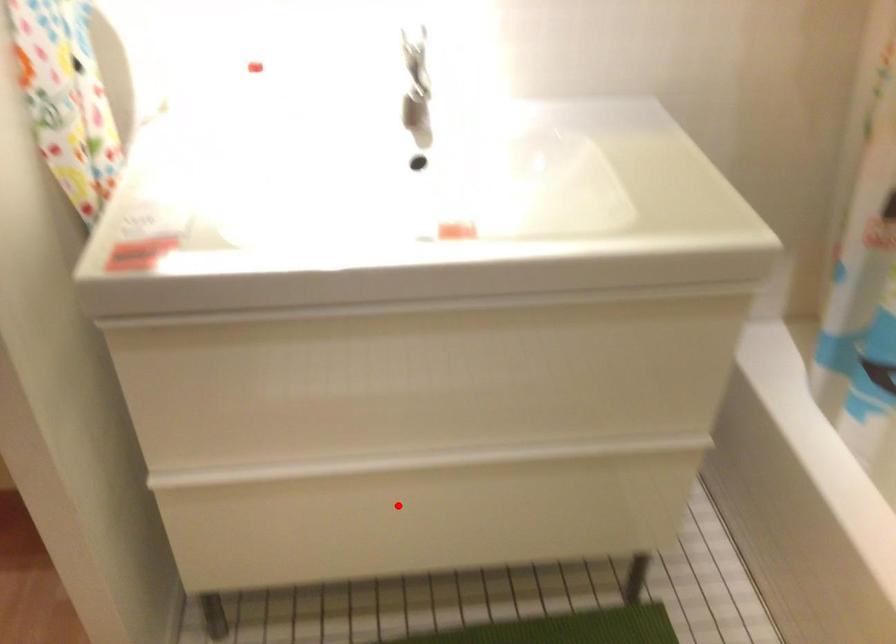
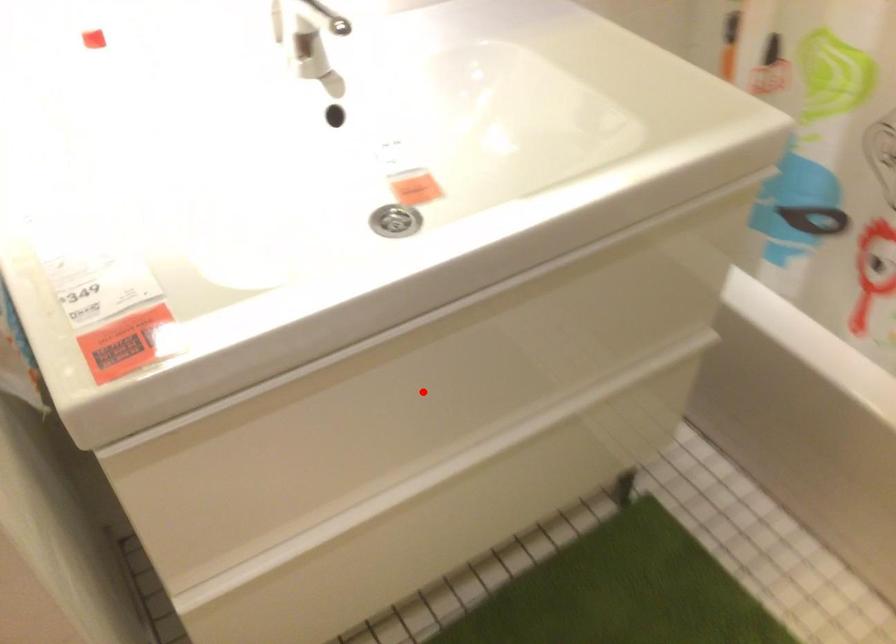
I am providing you with two images of the same scene from different viewpoints. A red point is marked on the first image and another point is marked on the second image. Are the points marked in image1 and image2 representing the same 3D position?

No